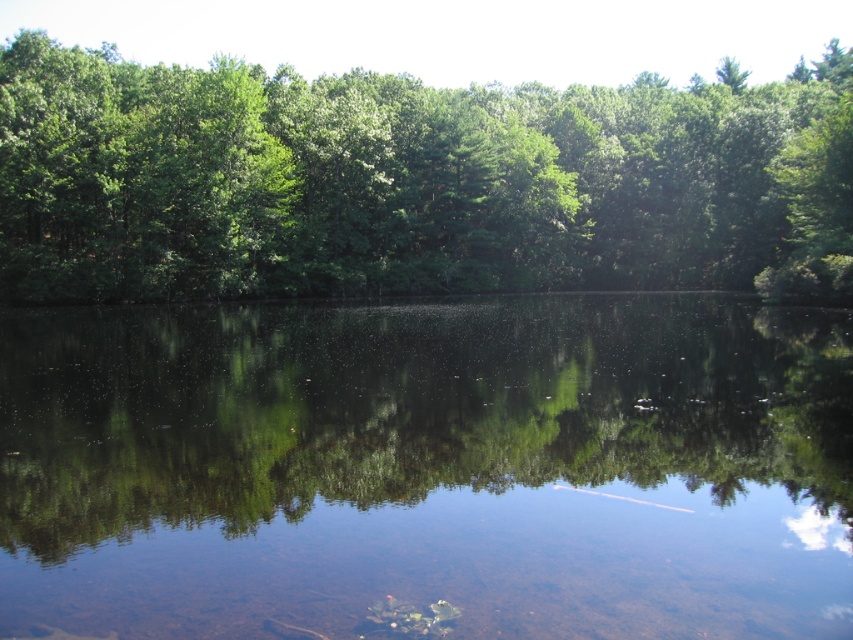
Does point (804, 396) lie in front of point (440, 230)?

Yes, point (804, 396) is closer to viewer.

Does clear water at center appear on the left side of green leafy trees at upper center?

No, clear water at center is not to the left of green leafy trees at upper center.

Find the location of a particular element. This screenshot has width=853, height=640. clear water at center is located at coordinates (427, 468).